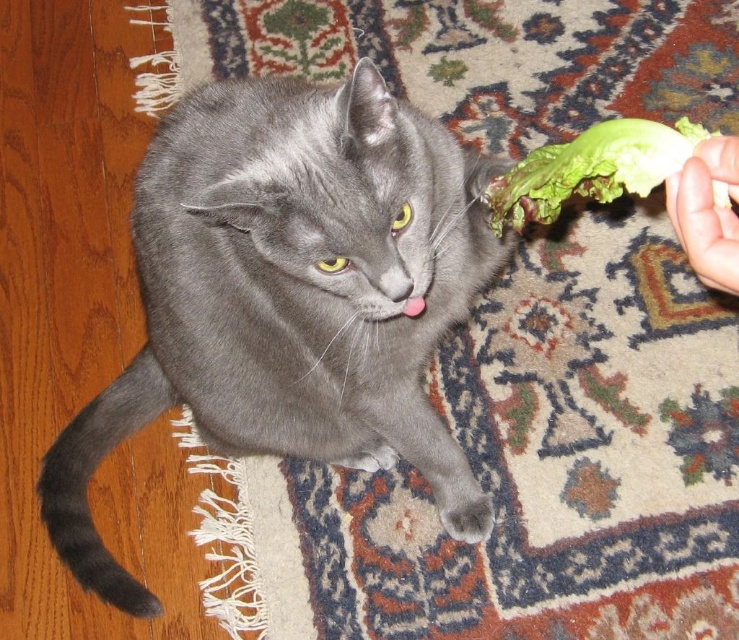
In the scene shown: Which is above, gray fur cat at center or smooth skin hand at upper right?

smooth skin hand at upper right is higher up.

Does gray fur cat at center have a lesser width compared to smooth skin hand at upper right?

In fact, gray fur cat at center might be wider than smooth skin hand at upper right.

What do you see at coordinates (290, 296) in the screenshot? This screenshot has width=739, height=640. I see `gray fur cat at center` at bounding box center [290, 296].

At what (x,y) coordinates should I click in order to perform the action: click on gray fur cat at center. Please return your answer as a coordinate pair (x, y). The image size is (739, 640). Looking at the image, I should click on (290, 296).

Who is more forward, (x=653, y=168) or (x=684, y=234)?

Point (x=684, y=234) is in front.

Is green leafy lettuce at upper right shorter than smooth skin hand at upper right?

Yes, green leafy lettuce at upper right is shorter than smooth skin hand at upper right.

At what (x,y) coordinates should I click in order to perform the action: click on green leafy lettuce at upper right. Please return your answer as a coordinate pair (x, y). Image resolution: width=739 pixels, height=640 pixels. Looking at the image, I should click on (590, 170).

How distant is gray fur cat at center from green leafy lettuce at upper right?

gray fur cat at center and green leafy lettuce at upper right are 13.17 inches apart.

Can you confirm if gray fur cat at center is taller than green leafy lettuce at upper right?

Yes.

Which is behind, point (258, 452) or point (548, 211)?

The point (258, 452) is more distant.

Find the location of a particular element. gray fur cat at center is located at coordinates (290, 296).